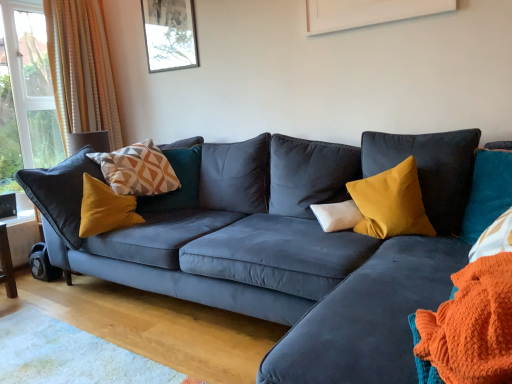
Question: In terms of height, does matte glass picture frame at upper center look taller or shorter compared to geometric-patterned fabric pillow at left, marked as the third pillow in a right-to-left arrangement?

Choices:
 (A) tall
 (B) short

Answer: (A)

Question: Based on their positions, is matte glass picture frame at upper center located to the left or right of geometric-patterned fabric pillow at left, marked as the third pillow in a right-to-left arrangement?

Choices:
 (A) right
 (B) left

Answer: (A)

Question: Estimate the real-world distances between objects in this image. Which object is closer to the velvet mustard pillow at center, positioned as the third pillow in left-to-right order?

Choices:
 (A) white soft cushion at center, which is the second pillow in left-to-right order
 (B) geometric-patterned fabric pillow at left, marked as the third pillow in a right-to-left arrangement
 (C) matte glass picture frame at upper center
 (D) orange knitted blanket at lower right
 (E) orange striped curtain at left

Answer: (A)

Question: Based on their relative distances, which object is farther from the velvet mustard pillow at center, positioned as the third pillow in left-to-right order?

Choices:
 (A) orange knitted blanket at lower right
 (B) geometric-patterned fabric pillow at left, positioned as the first pillow in left-to-right order
 (C) orange striped curtain at left
 (D) matte glass picture frame at upper center
 (E) white soft cushion at center, which is the second pillow in left-to-right order

Answer: (C)